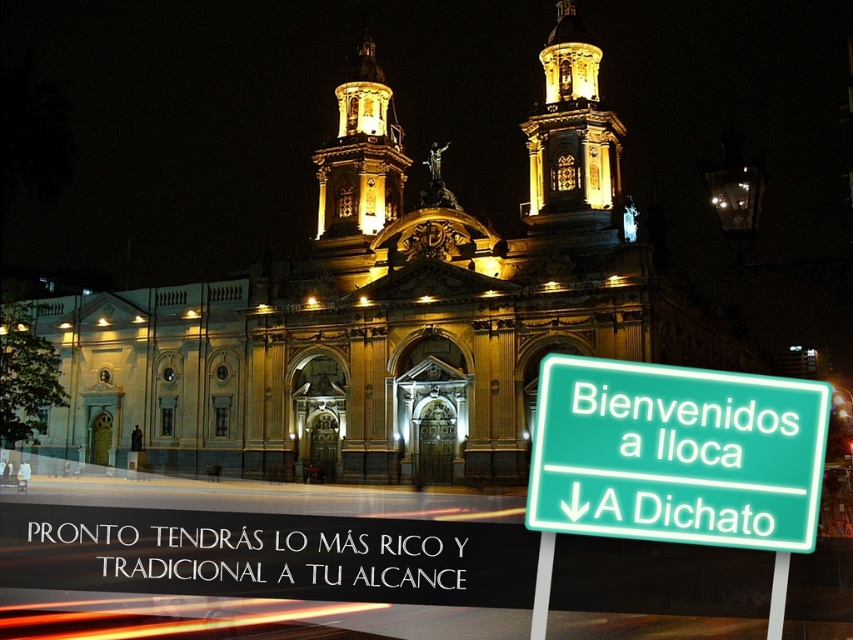
Question: Considering the relative positions of green fluorescent sign at lower right and green plastic signpost at lower right in the image provided, where is green fluorescent sign at lower right located with respect to green plastic signpost at lower right?

Choices:
 (A) left
 (B) right

Answer: (B)

Question: Is green plastic signpost at lower right to the right of metallic pole at lower right from the viewer's perspective?

Choices:
 (A) yes
 (B) no

Answer: (B)

Question: Based on their relative distances, which object is farther from the green fluorescent sign at lower right?

Choices:
 (A) green plastic signpost at lower right
 (B) metallic pole at lower right

Answer: (B)

Question: Which object is positioned closest to the metallic pole at lower right?

Choices:
 (A) green plastic signpost at lower right
 (B) green fluorescent sign at lower right

Answer: (B)

Question: Does green plastic signpost at lower right have a larger size compared to metallic pole at lower right?

Choices:
 (A) yes
 (B) no

Answer: (B)

Question: Among these points, which one is farthest from the camera?

Choices:
 (A) (809, 449)
 (B) (773, 582)
 (C) (537, 630)

Answer: (A)